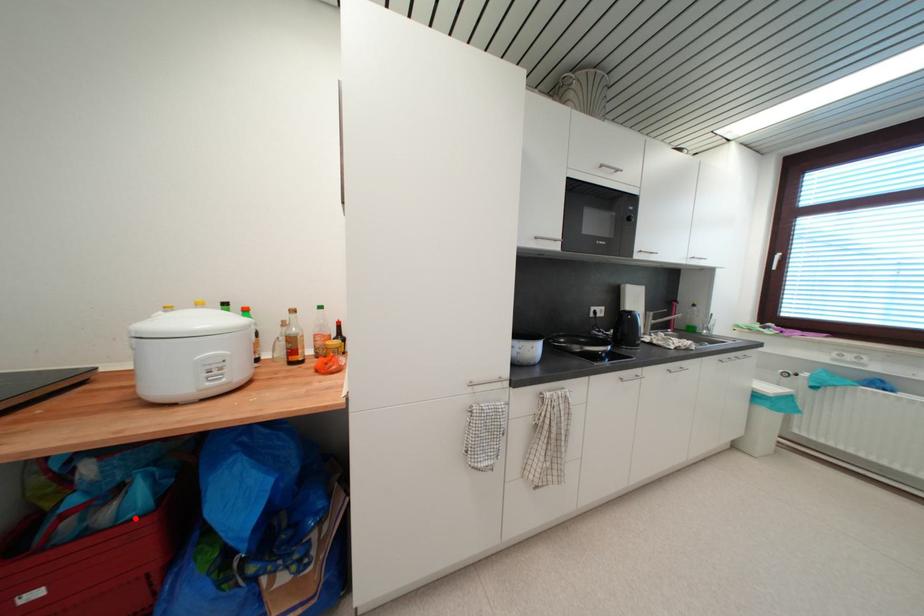
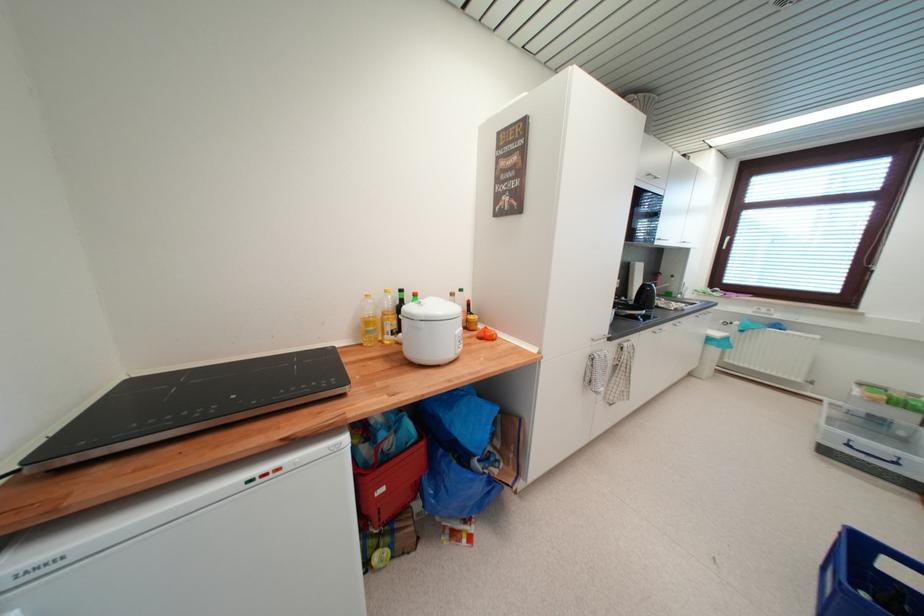
Locate, in the second image, the point that corresponds to the highlighted location in the first image.

(418, 444)